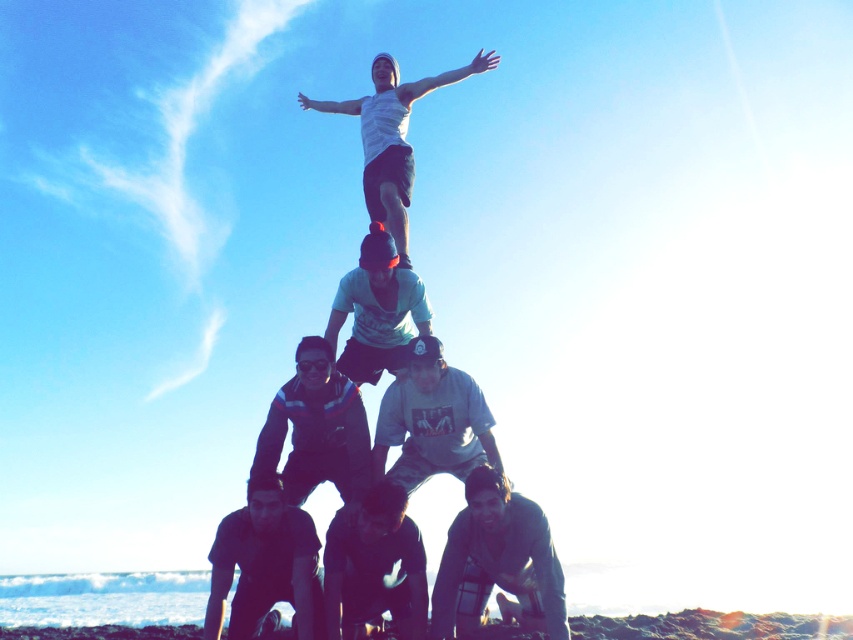
This screenshot has height=640, width=853. Describe the element at coordinates (316, 428) in the screenshot. I see `dark blue jacket at center` at that location.

Based on the photo, does dark blue jacket at center appear over dark blue shirt at center?

Result: Correct, dark blue jacket at center is located above dark blue shirt at center.

Is point (325, 342) behind point (375, 560)?

That is False.

This screenshot has height=640, width=853. Find the location of `dark blue jacket at center`. dark blue jacket at center is located at coordinates (316, 428).

Does dark gray fabric shirt at lower left have a greater height compared to dark blue jacket at center?

Incorrect, dark gray fabric shirt at lower left's height is not larger of dark blue jacket at center's.

Which is behind, point (218, 588) or point (325, 470)?

Positioned behind is point (325, 470).

Does point (297, 630) lie in front of point (320, 422)?

Yes.

Find the location of `dark gray fabric shirt at lower left`. dark gray fabric shirt at lower left is located at coordinates (265, 564).

Is point (287, 595) closer to viewer compared to point (354, 579)?

No.

Is dark gray fabric shirt at lower left to the left of dark blue shirt at center from the viewer's perspective?

Indeed, dark gray fabric shirt at lower left is positioned on the left side of dark blue shirt at center.

Is point (247, 602) positioned in front of point (405, 570)?

No, (247, 602) is behind (405, 570).

You are a GUI agent. You are given a task and a screenshot of the screen. Output one action in this format:
    pyautogui.click(x=<x>, y=<y>)
    Task: Click on the dark gray fabric shirt at lower left
    The height and width of the screenshot is (640, 853).
    Given the screenshot: What is the action you would take?
    pyautogui.click(x=265, y=564)